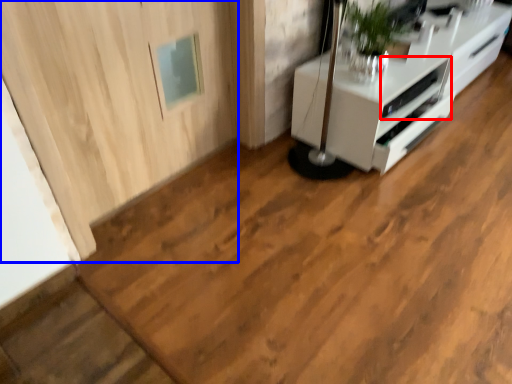
Question: Which object appears farthest to the camera in this image, appliance (highlighted by a red box) or door (highlighted by a blue box)?

Choices:
 (A) appliance
 (B) door

Answer: (A)